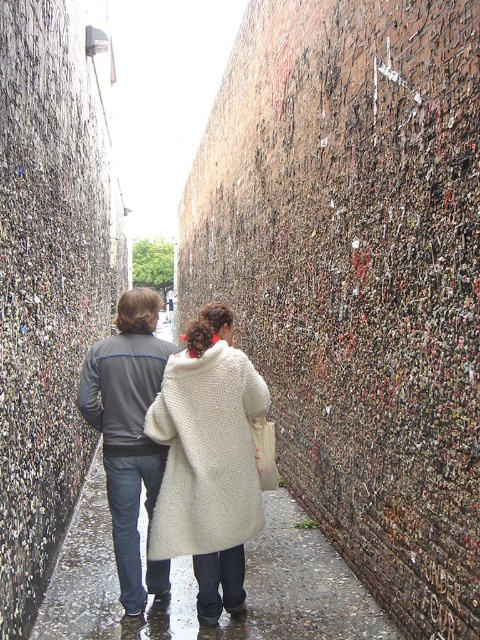
Question: Among these points, which one is nearest to the camera?

Choices:
 (A) (223, 460)
 (B) (140, 452)

Answer: (A)

Question: Is wet asphalt sidewalk at center thinner than white fabric shopping bag at center?

Choices:
 (A) no
 (B) yes

Answer: (A)

Question: Among these points, which one is farthest from the camera?

Choices:
 (A) (168, 518)
 (B) (153, 388)
 (C) (276, 465)
 (D) (380, 627)

Answer: (C)

Question: Is white fuzzy coat at center bigger than white fabric shopping bag at center?

Choices:
 (A) no
 (B) yes

Answer: (B)

Question: Estimate the real-world distances between objects in this image. Which object is closer to the wet asphalt sidewalk at center?

Choices:
 (A) white fuzzy coat at center
 (B) white fabric shopping bag at center

Answer: (A)

Question: Where is wet asphalt sidewalk at center located in relation to gray fabric jacket at center in the image?

Choices:
 (A) below
 (B) above

Answer: (A)